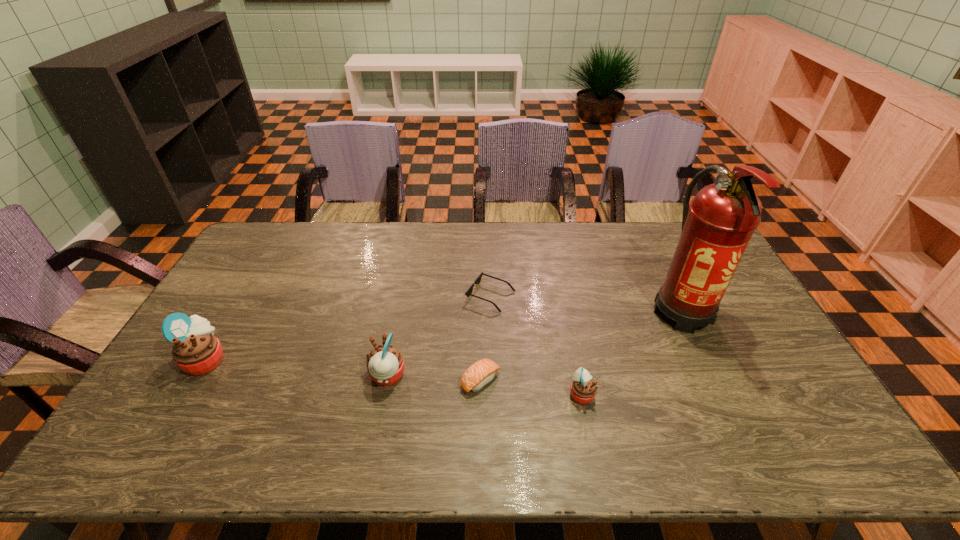
Given the evenly spaced muffins in the image, where should an extra muffin be added on the right to preserve the spacing? Please point to a vacant space. Please provide its 2D coordinates. Your answer should be formatted as a tuple, i.e. [(x, y)], where the tuple contains the x and y coordinates of a point satisfying the conditions above.

[(791, 413)]